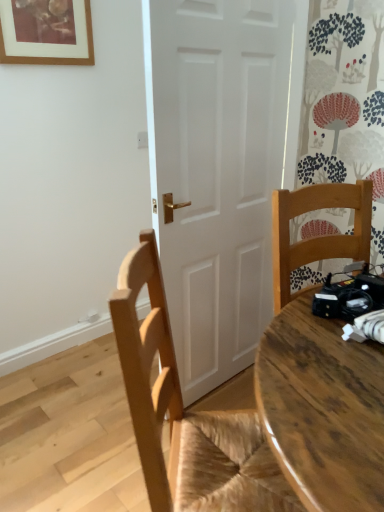
Question: Is wooden chair at center positioned with its back to matte wooden picture frame at upper left?

Choices:
 (A) yes
 (B) no

Answer: (B)

Question: From a real-world perspective, is wooden chair at center below matte wooden picture frame at upper left?

Choices:
 (A) no
 (B) yes

Answer: (B)

Question: Is wooden chair at center not inside matte wooden picture frame at upper left?

Choices:
 (A) yes
 (B) no

Answer: (A)

Question: From the image's perspective, is wooden chair at center located above matte wooden picture frame at upper left?

Choices:
 (A) yes
 (B) no

Answer: (B)

Question: Considering the relative sizes of wooden chair at center and matte wooden picture frame at upper left in the image provided, is wooden chair at center thinner than matte wooden picture frame at upper left?

Choices:
 (A) no
 (B) yes

Answer: (A)

Question: Is wooden chair at center at the right side of matte wooden picture frame at upper left?

Choices:
 (A) no
 (B) yes

Answer: (B)

Question: Does matte wooden picture frame at upper left have a smaller size compared to wooden chair at center?

Choices:
 (A) no
 (B) yes

Answer: (B)

Question: Is matte wooden picture frame at upper left to the right of wooden chair at center from the viewer's perspective?

Choices:
 (A) yes
 (B) no

Answer: (B)

Question: Is matte wooden picture frame at upper left bigger than wooden chair at center?

Choices:
 (A) no
 (B) yes

Answer: (A)

Question: Is matte wooden picture frame at upper left beside wooden chair at center?

Choices:
 (A) no
 (B) yes

Answer: (A)

Question: Is wooden chair at center located within matte wooden picture frame at upper left?

Choices:
 (A) yes
 (B) no

Answer: (B)

Question: Is matte wooden picture frame at upper left far from wooden chair at center?

Choices:
 (A) no
 (B) yes

Answer: (B)

Question: Considering the positions of matte wooden picture frame at upper left and wooden chair at center in the image, is matte wooden picture frame at upper left bigger or smaller than wooden chair at center?

Choices:
 (A) big
 (B) small

Answer: (B)